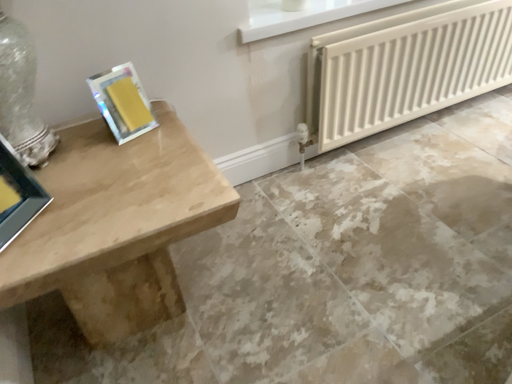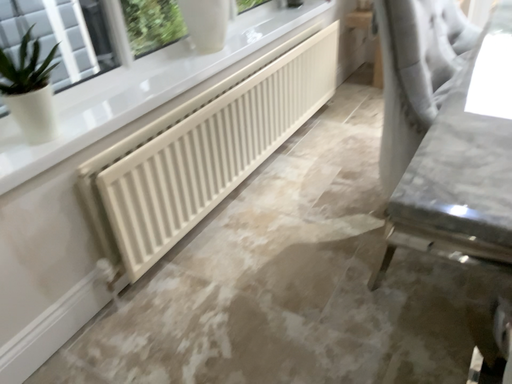
Question: Which way did the camera rotate in the video?

Choices:
 (A) rotated right
 (B) rotated left

Answer: (A)